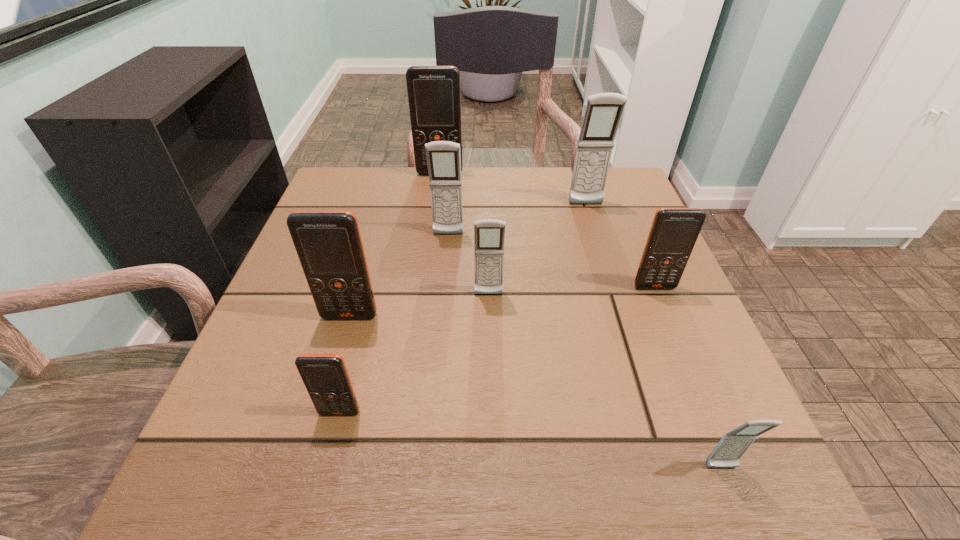
This screenshot has height=540, width=960. Find the location of `vacant region at the near left corner`. vacant region at the near left corner is located at coordinates (250, 457).

Identify the location of blank space at the far right corner of the desktop. (609, 208).

Image resolution: width=960 pixels, height=540 pixels. In order to click on free space between the second farthest gray cellular telephone and the seventh nearest object in this screenshot , I will do `click(517, 220)`.

I want to click on free point between the second nearest object and the second nearest orange cellular telephone, so click(345, 364).

At what (x,y) coordinates should I click in order to perform the action: click on vacant region between the third biggest orange cellular telephone and the seventh farthest object. Please return your answer as a coordinate pair (x, y). Image resolution: width=960 pixels, height=540 pixels. Looking at the image, I should click on (497, 350).

I want to click on vacant space in between the third smallest orange cellular telephone and the third farthest cellular telephone, so click(399, 275).

What are the coordinates of `free space between the smallest gray cellular telephone and the second farthest orange cellular telephone` in the screenshot? It's located at (688, 377).

The image size is (960, 540). Identify the location of free space between the rightmost gray cellular telephone and the smallest orange cellular telephone. (531, 440).

This screenshot has width=960, height=540. What are the coordinates of `free space between the rightmost gray cellular telephone and the second smallest orange cellular telephone` in the screenshot? It's located at (688, 377).

What are the coordinates of `vacant area between the nearest orange cellular telephone and the nearest gray cellular telephone` in the screenshot? It's located at (531, 440).